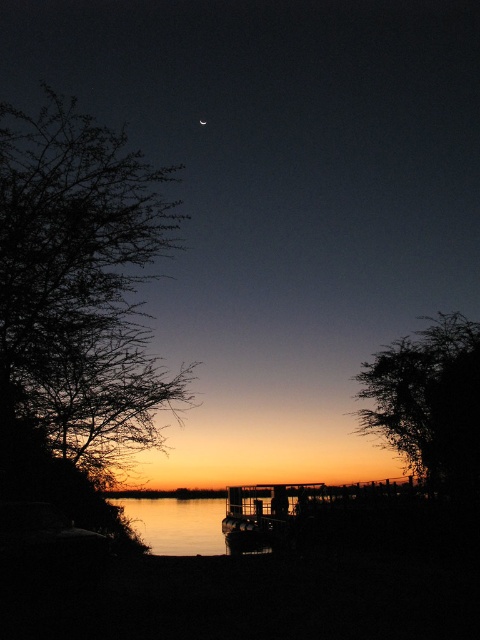
You are standing on the silhouette wooden dock at center and want to look at the silhouette leafy tree at left. In which direction should you turn your head to see it?

The silhouette leafy tree at left is located above the silhouette wooden dock at center, so you should look upwards to see it.

You are an astronomer observing the twilight scene. You notice the silky water at center and the bright silver moon at upper center. Which object appears taller in the image?

The silky water at center appears taller than the bright silver moon at upper center in the image.

You are standing at the point marked by the coordinates point (179, 524) in the twilight scene by the water. Describe what you see around you based on the provided scene description.

The point (179, 524) indicates silky water at center, so you are standing in the silky water at center of the twilight scene by the water.